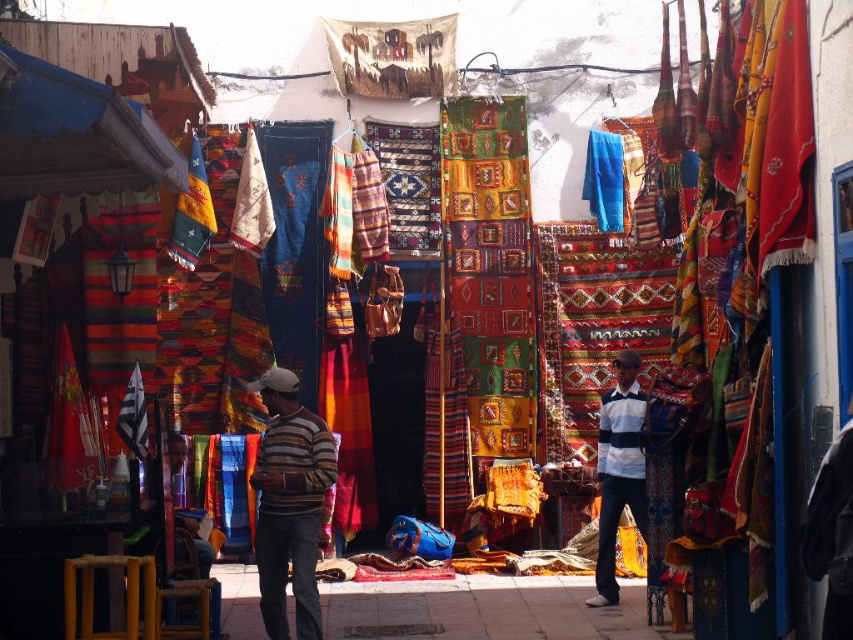
Is striped cotton sweater at center shorter than white striped shirt at center?

Indeed, striped cotton sweater at center has a lesser height compared to white striped shirt at center.

Does point (287, 477) come farther from viewer compared to point (601, 490)?

No, it is in front of (601, 490).

Where is `striped cotton sweater at center`? striped cotton sweater at center is located at coordinates (289, 502).